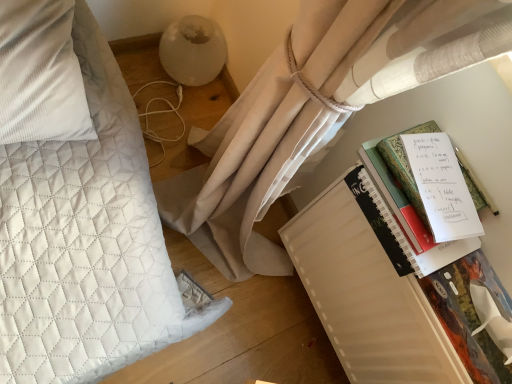
The image size is (512, 384). I want to click on white matte notebook at right, positioned as the second paperback book in front-to-back order, so click(367, 290).

Measure the distance between white matte notebook at right, positioned as the second paperback book in front-to-back order, and camera.

white matte notebook at right, positioned as the second paperback book in front-to-back order, is 73.85 centimeters from camera.

What is the approximate width of white quilted pillow at left?

It is 14.79 inches.

This screenshot has height=384, width=512. Identify the location of white quilted pillow at left. (40, 74).

Where is `hardcover book at right, the first paperback book from the front`? This screenshot has width=512, height=384. hardcover book at right, the first paperback book from the front is located at coordinates (473, 315).

Is white quilted pillow at left not within white paper notebook at right?

Yes, white quilted pillow at left is not within white paper notebook at right.

The height and width of the screenshot is (384, 512). In order to click on book above the white quilted pillow at left (from a real-world perspective) in this screenshot , I will do `click(406, 211)`.

Looking at this image, considering their positions, is white quilted pillow at left located in front of or behind white paper notebook at right?

Clearly, white quilted pillow at left is in front of white paper notebook at right.

From the image's perspective, between white quilted pillow at left and white paper notebook at right, which one is located above?

white quilted pillow at left is shown above in the image.

Looking at this image, can you confirm if white matte notebook at right, which is the first paperback book from back to front, is positioned to the left of white quilted pillow at left?

No.

Can you tell me how much white matte notebook at right, positioned as the second paperback book in front-to-back order, and white quilted pillow at left differ in facing direction?

The angle between the facing direction of white matte notebook at right, positioned as the second paperback book in front-to-back order, and the facing direction of white quilted pillow at left is 93.7 degrees.

Is point (315, 305) positioned before point (3, 28)?

No, (315, 305) is behind (3, 28).

The width and height of the screenshot is (512, 384). What are the coordinates of `pillow to the left of white matte notebook at right, positioned as the second paperback book in front-to-back order` in the screenshot? It's located at (40, 74).

Considering their positions, is hardcover book at right, the first paperback book from the front, located in front of or behind white paper notebook at right?

Clearly, hardcover book at right, the first paperback book from the front, is in front of white paper notebook at right.

Would you say hardcover book at right, the first paperback book from the front, is inside or outside white paper notebook at right?

hardcover book at right, the first paperback book from the front, is located beyond the bounds of white paper notebook at right.

Is hardcover book at right, the first paperback book from the front, oriented away from white paper notebook at right?

hardcover book at right, the first paperback book from the front, is not turned away from white paper notebook at right.

Based on the photo, which point is more forward, [473,299] or [385,216]?

Point [473,299]

Visually, is white paper notebook at right positioned to the left or to the right of white matte notebook at right, which is the first paperback book from back to front?

white paper notebook at right is positioned on white matte notebook at right, which is the first paperback book from back to front,'s right side.

Which of these two, white paper notebook at right or white matte notebook at right, which is the first paperback book from back to front, is bigger?

Bigger between the two is white matte notebook at right, which is the first paperback book from back to front.

From a real-world perspective, which is physically below, white paper notebook at right or white matte notebook at right, which is the first paperback book from back to front?

white matte notebook at right, which is the first paperback book from back to front.

Considering the sizes of objects white paper notebook at right and white matte notebook at right, which is the first paperback book from back to front, in the image provided, who is shorter, white paper notebook at right or white matte notebook at right, which is the first paperback book from back to front,?

white paper notebook at right is shorter.

Considering the positions of objects hardcover book at right, which is the second paperback book from back to front, and white quilted pillow at left in the image provided, who is more to the left, hardcover book at right, which is the second paperback book from back to front, or white quilted pillow at left?

From the viewer's perspective, white quilted pillow at left appears more on the left side.

Does hardcover book at right, the first paperback book from the front, turn towards white quilted pillow at left?

No, hardcover book at right, the first paperback book from the front, is not facing towards white quilted pillow at left.

Looking at the image, does hardcover book at right, the first paperback book from the front, seem bigger or smaller compared to white quilted pillow at left?

hardcover book at right, the first paperback book from the front, is smaller than white quilted pillow at left.

From a real-world perspective, between hardcover book at right, the first paperback book from the front, and white quilted pillow at left, who is vertically lower?

white quilted pillow at left, from a real-world perspective.

Is white quilted pillow at left next to hardcover book at right, which is the second paperback book from back to front?

white quilted pillow at left and hardcover book at right, which is the second paperback book from back to front, are clearly separated.

Does white quilted pillow at left have a lesser width compared to hardcover book at right, the first paperback book from the front?

No, white quilted pillow at left is not thinner than hardcover book at right, the first paperback book from the front.

Could you measure the distance between white quilted pillow at left and hardcover book at right, which is the second paperback book from back to front?

They are 31.02 inches apart.

Between white paper notebook at right and white quilted pillow at left, which one appears on the left side from the viewer's perspective?

white quilted pillow at left.

Is white paper notebook at right inside the boundaries of white quilted pillow at left, or outside?

white paper notebook at right exists outside the volume of white quilted pillow at left.

Where is `pillow in front of the white paper notebook at right`? Image resolution: width=512 pixels, height=384 pixels. pillow in front of the white paper notebook at right is located at coordinates (40, 74).

Identify the location of paperback book that is the 2nd object located below the white quilted pillow at left (from the image's perspective). The width and height of the screenshot is (512, 384). (367, 290).

From the image, which object appears to be farther from white matte notebook at right, positioned as the second paperback book in front-to-back order, white paper notebook at right or hardcover book at right, the first paperback book from the front?

white paper notebook at right lies further to white matte notebook at right, positioned as the second paperback book in front-to-back order, than the other object.

From the image, which object appears to be nearer to hardcover book at right, which is the second paperback book from back to front, white matte notebook at right, which is the first paperback book from back to front, or white quilted pillow at left?

white matte notebook at right, which is the first paperback book from back to front, lies closer to hardcover book at right, which is the second paperback book from back to front, than the other object.

Looking at the image, which one is located closer to white quilted pillow at left, white paper notebook at right or hardcover book at right, the first paperback book from the front?

white paper notebook at right is closer to white quilted pillow at left.

Estimate the real-world distances between objects in this image. Which object is further from hardcover book at right, the first paperback book from the front, white paper notebook at right or white quilted pillow at left?

Among the two, white quilted pillow at left is located further to hardcover book at right, the first paperback book from the front.

From the image, which object appears to be farther from hardcover book at right, the first paperback book from the front, white quilted pillow at left or white matte notebook at right, which is the first paperback book from back to front?

The object further to hardcover book at right, the first paperback book from the front, is white quilted pillow at left.

When comparing their distances from hardcover book at right, which is the second paperback book from back to front, does white paper notebook at right or white matte notebook at right, positioned as the second paperback book in front-to-back order, seem closer?

The object closer to hardcover book at right, which is the second paperback book from back to front, is white paper notebook at right.

Looking at the image, which one is located closer to white paper notebook at right, white quilted pillow at left or white matte notebook at right, positioned as the second paperback book in front-to-back order?

white matte notebook at right, positioned as the second paperback book in front-to-back order, is closer to white paper notebook at right.

Estimate the real-world distances between objects in this image. Which object is closer to white paper notebook at right, white matte notebook at right, positioned as the second paperback book in front-to-back order, or white quilted pillow at left?

The object closer to white paper notebook at right is white matte notebook at right, positioned as the second paperback book in front-to-back order.

In order to click on paperback book that lies between white paper notebook at right and white matte notebook at right, which is the first paperback book from back to front, from top to bottom in this screenshot , I will do pyautogui.click(x=473, y=315).

You are a GUI agent. You are given a task and a screenshot of the screen. Output one action in this format:
    pyautogui.click(x=<x>, y=<y>)
    Task: Click on the paperback book between white quilted pillow at left and hardcover book at right, the first paperback book from the front, from left to right
    
    Given the screenshot: What is the action you would take?
    pyautogui.click(x=367, y=290)

The image size is (512, 384). Find the location of `book situated between white quilted pillow at left and hardcover book at right, the first paperback book from the front, from left to right`. book situated between white quilted pillow at left and hardcover book at right, the first paperback book from the front, from left to right is located at coordinates (406, 211).

This screenshot has height=384, width=512. I want to click on paperback book between white quilted pillow at left and white paper notebook at right from left to right, so click(367, 290).